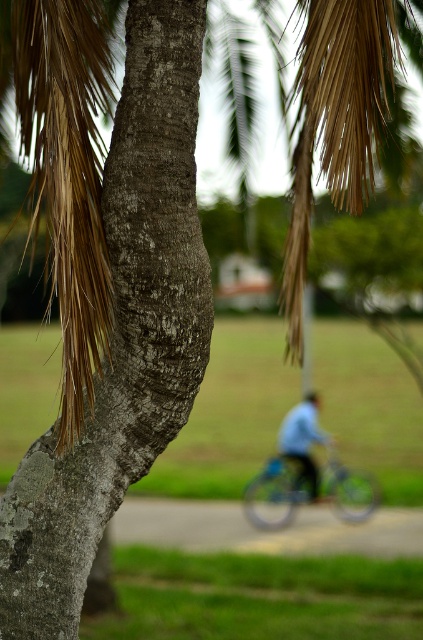
You are standing in front of the tree trunk and want to take a photo of the metallic blue bicycle at center and the blue matte shirt at center. Which object should you focus on first to ensure both are in focus?

You should focus on the metallic blue bicycle at center first since it is closer to the viewer than the blue matte shirt at center, ensuring both will be in focus when using proper depth of field.

Based on the photo, you are a photographer trying to capture a clear shot of the metallic blue bicycle at center and the blue matte shirt at center. Since the scene has a shallow depth of field, which object will appear more in focus?

The metallic blue bicycle at center is larger in size than the blue matte shirt at center, so the bicycle will appear more in focus due to its size and position within the depth of field.

You are standing in front of the tree trunk and want to take a photo of the metallic blue bicycle at center and the blue matte shirt at center. Which object should you move your camera to the left to capture both in the frame?

You should move your camera to the left to include the metallic blue bicycle at center, since it is positioned on the right side of the blue matte shirt at center.